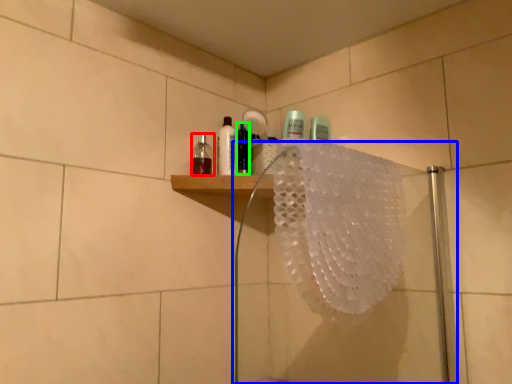
Question: Based on their relative distances, which object is farther from mouthwash (highlighted by a red box)? Choose from shower door (highlighted by a blue box) and mouthwash (highlighted by a green box).

Choices:
 (A) shower door
 (B) mouthwash

Answer: (A)